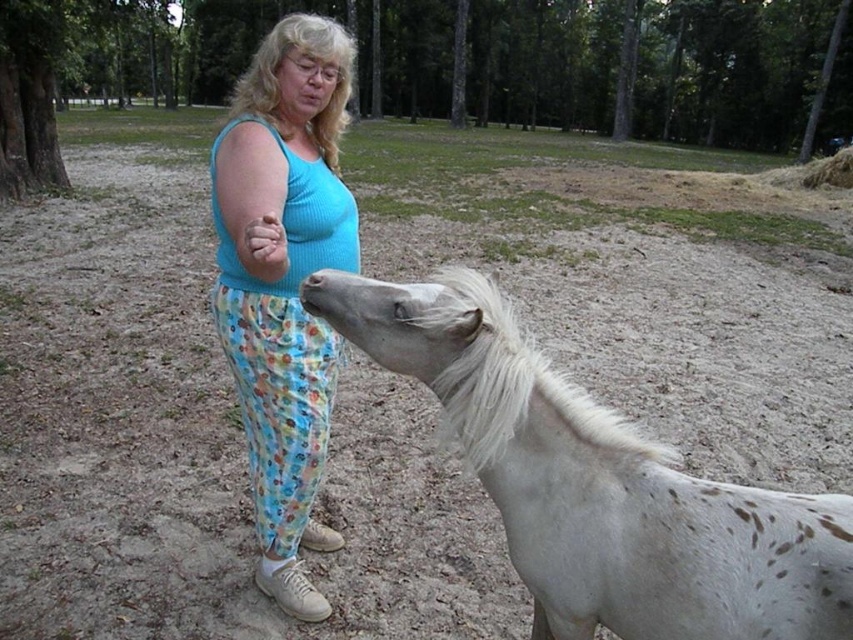
Does white speckled horse at lower right have a larger size compared to blue cotton tank top at center?

No, white speckled horse at lower right is not bigger than blue cotton tank top at center.

Does white speckled horse at lower right have a greater width compared to blue cotton tank top at center?

No.

You are a GUI agent. You are given a task and a screenshot of the screen. Output one action in this format:
    pyautogui.click(x=<x>, y=<y>)
    Task: Click on the white speckled horse at lower right
    The image size is (853, 640).
    Given the screenshot: What is the action you would take?
    pyautogui.click(x=598, y=483)